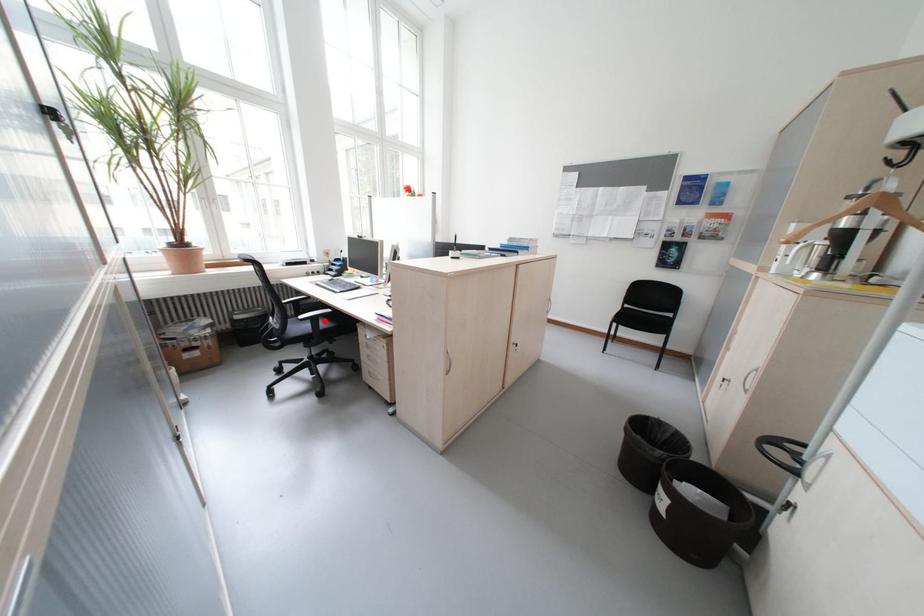
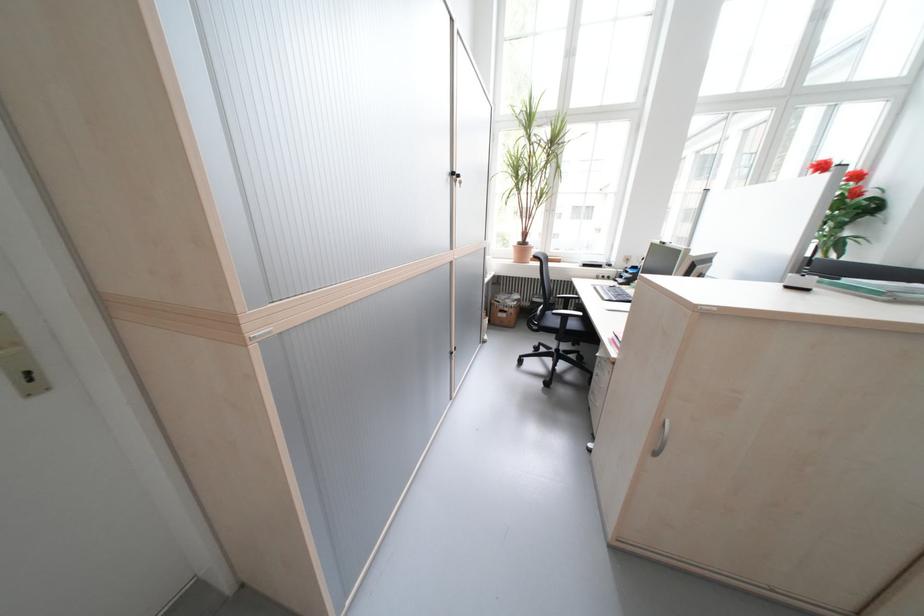
Find the pixel in the second image that matches the highlighted location in the first image.

(575, 318)